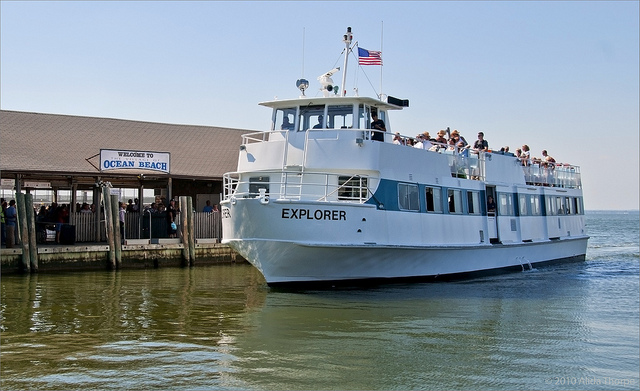
Where is `light reflections`? light reflections is located at coordinates (129, 357), (153, 368), (198, 355), (131, 312), (224, 338), (38, 320), (28, 301), (394, 331), (611, 246), (598, 304).